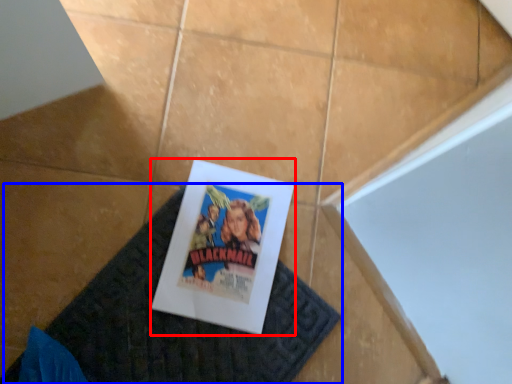
Question: Which of the following is the farthest to the observer, poster (highlighted by a red box) or doormat (highlighted by a blue box)?

Choices:
 (A) poster
 (B) doormat

Answer: (A)